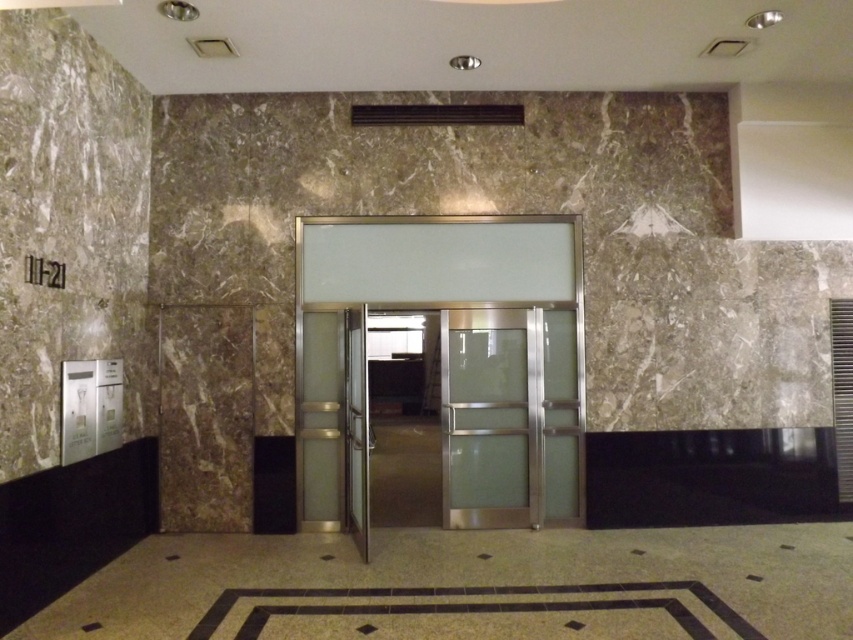
Which is above, satin glass elevator doors at center or clear glass door at center?

satin glass elevator doors at center is above.

Who is taller, satin glass elevator doors at center or clear glass door at center?

satin glass elevator doors at center

Who is more distant from viewer, [347,435] or [457,448]?

The point [457,448] is more distant.

Find the location of a particular element. This screenshot has width=853, height=640. satin glass elevator doors at center is located at coordinates (448, 362).